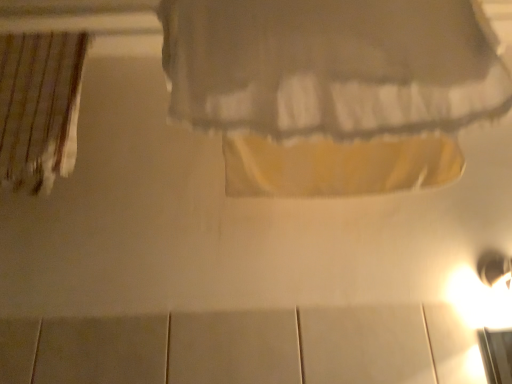
Measure the distance between matte white curtain at upper center, which is the 1th curtain from right to left, and camera.

matte white curtain at upper center, which is the 1th curtain from right to left, and camera are 23.01 inches apart from each other.

Describe the element at coordinates (330, 66) in the screenshot. I see `matte white curtain at upper center, which is the 1th curtain from right to left` at that location.

Locate an element on the screen. This screenshot has height=384, width=512. matte white curtain at upper center, the second curtain positioned from the left is located at coordinates (330, 66).

You are a GUI agent. You are given a task and a screenshot of the screen. Output one action in this format:
    pyautogui.click(x=<x>, y=<y>)
    Task: Click on the striped fabric curtain at left, the first curtain positioned from the back
    This screenshot has height=384, width=512.
    Given the screenshot: What is the action you would take?
    pyautogui.click(x=39, y=108)

The width and height of the screenshot is (512, 384). Describe the element at coordinates (39, 108) in the screenshot. I see `striped fabric curtain at left, marked as the second curtain in a right-to-left arrangement` at that location.

What is the approximate width of striped fabric curtain at left, the first curtain positioned from the back?

3.01 inches.

This screenshot has height=384, width=512. I want to click on matte white curtain at upper center, which is counted as the 1th curtain, starting from the front, so click(330, 66).

Based on the photo, considering the positions of objects striped fabric curtain at left, the 1th curtain from the left, and matte white curtain at upper center, the second curtain positioned from the left, in the image provided, who is more to the left, striped fabric curtain at left, the 1th curtain from the left, or matte white curtain at upper center, the second curtain positioned from the left,?

striped fabric curtain at left, the 1th curtain from the left.

Which object is further away from the camera, striped fabric curtain at left, marked as the second curtain in a right-to-left arrangement, or matte white curtain at upper center, which is counted as the 1th curtain, starting from the front?

striped fabric curtain at left, marked as the second curtain in a right-to-left arrangement, is further away from the camera.

Which is behind, point (39, 114) or point (206, 54)?

Positioned behind is point (39, 114).

From the image's perspective, is striped fabric curtain at left, the 1th curtain from the left, over matte white curtain at upper center, the second curtain positioned from the left?

A: Actually, striped fabric curtain at left, the 1th curtain from the left, appears below matte white curtain at upper center, the second curtain positioned from the left, in the image.

Looking at this image, from a real-world perspective, is striped fabric curtain at left, the second curtain in the front-to-back sequence, located beneath matte white curtain at upper center, which is counted as the 1th curtain, starting from the front?

No.

Does striped fabric curtain at left, marked as the second curtain in a right-to-left arrangement, have a greater width compared to matte white curtain at upper center, acting as the 2th curtain starting from the back?

No, striped fabric curtain at left, marked as the second curtain in a right-to-left arrangement, is not wider than matte white curtain at upper center, acting as the 2th curtain starting from the back.

Does striped fabric curtain at left, marked as the second curtain in a right-to-left arrangement, have a lesser height compared to matte white curtain at upper center, which is counted as the 1th curtain, starting from the front?

No, striped fabric curtain at left, marked as the second curtain in a right-to-left arrangement, is not shorter than matte white curtain at upper center, which is counted as the 1th curtain, starting from the front.

Which of these two, striped fabric curtain at left, marked as the second curtain in a right-to-left arrangement, or matte white curtain at upper center, which is counted as the 1th curtain, starting from the front, is bigger?

matte white curtain at upper center, which is counted as the 1th curtain, starting from the front.

Could matte white curtain at upper center, which is the 1th curtain from right to left, be considered to be inside striped fabric curtain at left, the second curtain in the front-to-back sequence?

No, striped fabric curtain at left, the second curtain in the front-to-back sequence, does not contain matte white curtain at upper center, which is the 1th curtain from right to left.

Is the surface of striped fabric curtain at left, the first curtain positioned from the back, in direct contact with matte white curtain at upper center, which is the 1th curtain from right to left?

No, striped fabric curtain at left, the first curtain positioned from the back, is not in contact with matte white curtain at upper center, which is the 1th curtain from right to left.

Is striped fabric curtain at left, the 1th curtain from the left, turned away from matte white curtain at upper center, which is counted as the 1th curtain, starting from the front?

striped fabric curtain at left, the 1th curtain from the left, is not turned away from matte white curtain at upper center, which is counted as the 1th curtain, starting from the front.

You are a GUI agent. You are given a task and a screenshot of the screen. Output one action in this format:
    pyautogui.click(x=<x>, y=<y>)
    Task: Click on the curtain on the right of striped fabric curtain at left, the 1th curtain from the left
    The height and width of the screenshot is (384, 512).
    Given the screenshot: What is the action you would take?
    pyautogui.click(x=330, y=66)

Can you confirm if matte white curtain at upper center, acting as the 2th curtain starting from the back, is positioned to the right of striped fabric curtain at left, the 1th curtain from the left?

Yes.

Considering the positions of objects matte white curtain at upper center, the second curtain positioned from the left, and striped fabric curtain at left, the 1th curtain from the left, in the image provided, who is in front, matte white curtain at upper center, the second curtain positioned from the left, or striped fabric curtain at left, the 1th curtain from the left,?

matte white curtain at upper center, the second curtain positioned from the left, is closer to the camera.

Is point (446, 76) closer to camera compared to point (61, 146)?

Yes, point (446, 76) is in front of point (61, 146).

From the image's perspective, does matte white curtain at upper center, which is the 1th curtain from right to left, appear lower than striped fabric curtain at left, the first curtain positioned from the back?

No.

From a real-world perspective, is matte white curtain at upper center, which is counted as the 1th curtain, starting from the front, physically located above or below striped fabric curtain at left, the 1th curtain from the left?

In terms of real-world spatial position, matte white curtain at upper center, which is counted as the 1th curtain, starting from the front, is below striped fabric curtain at left, the 1th curtain from the left.

Between matte white curtain at upper center, which is the 1th curtain from right to left, and striped fabric curtain at left, the 1th curtain from the left, which one has larger width?

With larger width is matte white curtain at upper center, which is the 1th curtain from right to left.

Is matte white curtain at upper center, the second curtain positioned from the left, taller or shorter than striped fabric curtain at left, marked as the second curtain in a right-to-left arrangement?

matte white curtain at upper center, the second curtain positioned from the left, is shorter than striped fabric curtain at left, marked as the second curtain in a right-to-left arrangement.

In terms of size, does matte white curtain at upper center, the second curtain positioned from the left, appear bigger or smaller than striped fabric curtain at left, the first curtain positioned from the back?

Considering their sizes, matte white curtain at upper center, the second curtain positioned from the left, takes up more space than striped fabric curtain at left, the first curtain positioned from the back.

Can we say matte white curtain at upper center, which is the 1th curtain from right to left, lies outside striped fabric curtain at left, the second curtain in the front-to-back sequence?

Absolutely, matte white curtain at upper center, which is the 1th curtain from right to left, is external to striped fabric curtain at left, the second curtain in the front-to-back sequence.

Is there a large distance between matte white curtain at upper center, which is counted as the 1th curtain, starting from the front, and striped fabric curtain at left, the 1th curtain from the left?

matte white curtain at upper center, which is counted as the 1th curtain, starting from the front, is actually quite close to striped fabric curtain at left, the 1th curtain from the left.

Is matte white curtain at upper center, the second curtain positioned from the left, turned away from striped fabric curtain at left, the 1th curtain from the left?

No, matte white curtain at upper center, the second curtain positioned from the left,'s orientation is not away from striped fabric curtain at left, the 1th curtain from the left.

How different are the orientations of matte white curtain at upper center, which is counted as the 1th curtain, starting from the front, and striped fabric curtain at left, the 1th curtain from the left, in degrees?

There is a 8.7e-05-degree angle between the facing directions of matte white curtain at upper center, which is counted as the 1th curtain, starting from the front, and striped fabric curtain at left, the 1th curtain from the left.

Locate an element on the screen. Image resolution: width=512 pixels, height=384 pixels. curtain on the left of matte white curtain at upper center, the second curtain positioned from the left is located at coordinates tap(39, 108).

I want to click on curtain that is on the left side of matte white curtain at upper center, the second curtain positioned from the left, so click(39, 108).

At what (x,y) coordinates should I click in order to perform the action: click on curtain in front of the striped fabric curtain at left, the second curtain in the front-to-back sequence. Please return your answer as a coordinate pair (x, y). Looking at the image, I should click on (330, 66).